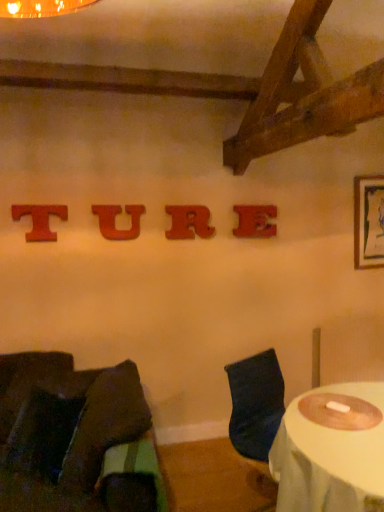
Question: Considering the positions of wooden letter r at center, the 2th alphabet when ordered from right to left, and wooden letter u at center, the 3th alphabet in the right-to-left sequence, in the image, is wooden letter r at center, the 2th alphabet when ordered from right to left, taller or shorter than wooden letter u at center, the 3th alphabet in the right-to-left sequence,?

Choices:
 (A) tall
 (B) short

Answer: (A)

Question: Is point (188, 216) closer or farther from the camera than point (140, 214)?

Choices:
 (A) farther
 (B) closer

Answer: (A)

Question: Considering the real-world distances, which object is farthest from the wooden letter e at center, which is the 4th alphabet in left-to-right order?

Choices:
 (A) velvet dark brown chair at lower left, the second chair from the right
 (B) wooden frame at upper right
 (C) white fabric-covered table at lower right
 (D) dark blue fabric chair at lower right, which ranks as the 1th chair in right-to-left order
 (E) wooden letter r at center, which is the third alphabet from left to right

Answer: (A)

Question: Estimate the real-world distances between objects in this image. Which object is farther from the wooden frame at upper right?

Choices:
 (A) velvet dark brown chair at lower left, the second chair from the right
 (B) dark blue fabric chair at lower right, which ranks as the second chair in left-to-right order
 (C) white fabric-covered table at lower right
 (D) wooden letter u at center, which is the 2th alphabet from left to right
 (E) wooden letter e at center, which is the 4th alphabet in left-to-right order

Answer: (A)